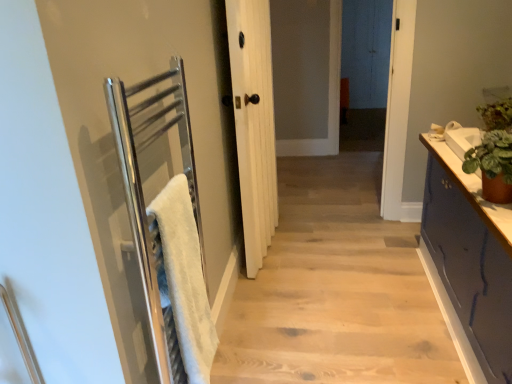
Question: From a real-world perspective, is brushed metal towel rail at left physically located above or below green leafy plant at right?

Choices:
 (A) below
 (B) above

Answer: (A)

Question: In terms of height, does brushed metal towel rail at left look taller or shorter compared to green leafy plant at right?

Choices:
 (A) short
 (B) tall

Answer: (A)

Question: Based on their relative distances, which object is farther from the white fluffy bath towel at left?

Choices:
 (A) white wood door at center
 (B) green leafy plant at right
 (C) green matte plant pot at right
 (D) dark blue painted cabinet at right
 (E) brushed metal towel rail at left

Answer: (B)

Question: Which of these objects is positioned farthest from the green leafy plant at right?

Choices:
 (A) dark blue painted cabinet at right
 (B) green matte plant pot at right
 (C) white wood door at center
 (D) brushed metal towel rail at left
 (E) white fluffy bath towel at left

Answer: (E)